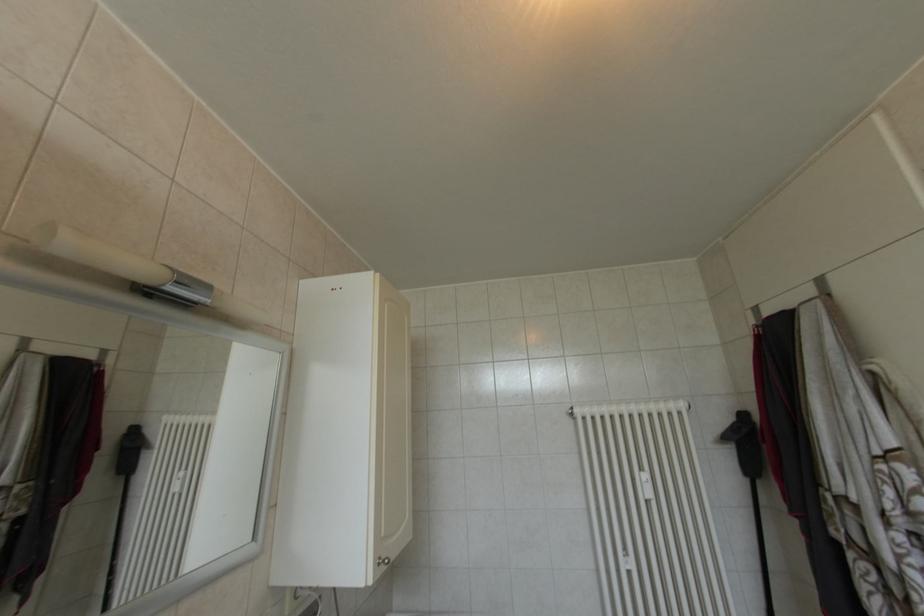
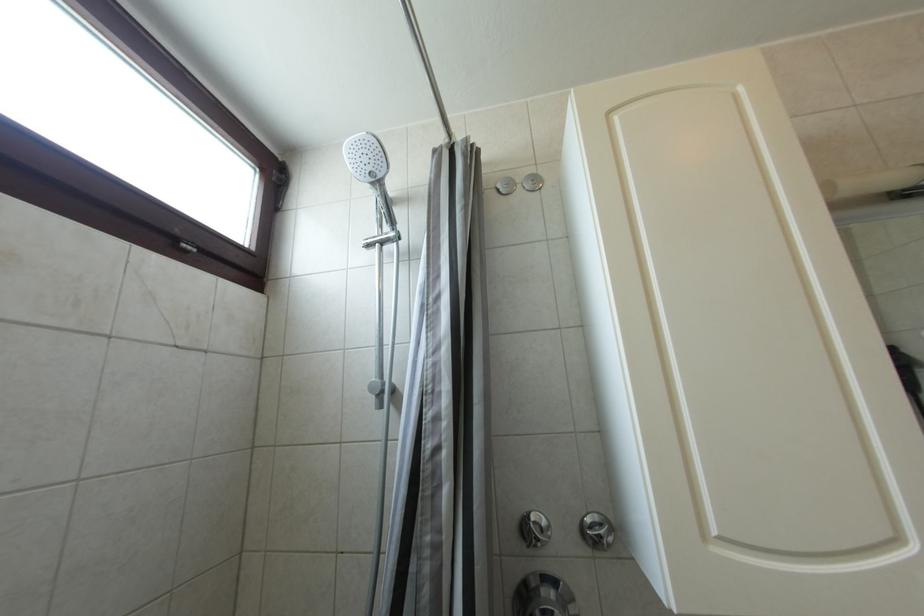
Question: The first image is from the beginning of the video and the second image is from the end. How did the camera likely rotate when shooting the video?

Choices:
 (A) Left
 (B) Right
 (C) Up
 (D) Down

Answer: (A)